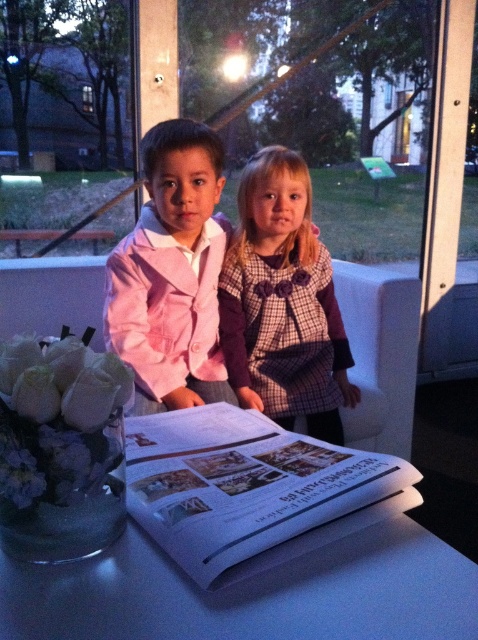
Question: Can you confirm if plaid fabric dress at center is bigger than white fabric flowers at lower left?

Choices:
 (A) no
 (B) yes

Answer: (B)

Question: Does white glossy table at center appear on the right side of plaid fabric dress at center?

Choices:
 (A) no
 (B) yes

Answer: (A)

Question: Estimate the real-world distances between objects in this image. Which object is closer to the white glossy table at center?

Choices:
 (A) matte pink jacket at center
 (B) white fabric flowers at lower left
 (C) plaid fabric dress at center

Answer: (B)

Question: Among these points, which one is farthest from the camera?

Choices:
 (A) (95, 406)
 (B) (121, 259)
 (C) (268, 500)

Answer: (B)

Question: Estimate the real-world distances between objects in this image. Which object is farther from the matte pink jacket at center?

Choices:
 (A) white glossy table at center
 (B) plaid fabric dress at center
 (C) white fabric flowers at lower left

Answer: (C)

Question: Can you confirm if plaid fabric dress at center is positioned below white fabric flowers at lower left?

Choices:
 (A) yes
 (B) no

Answer: (B)